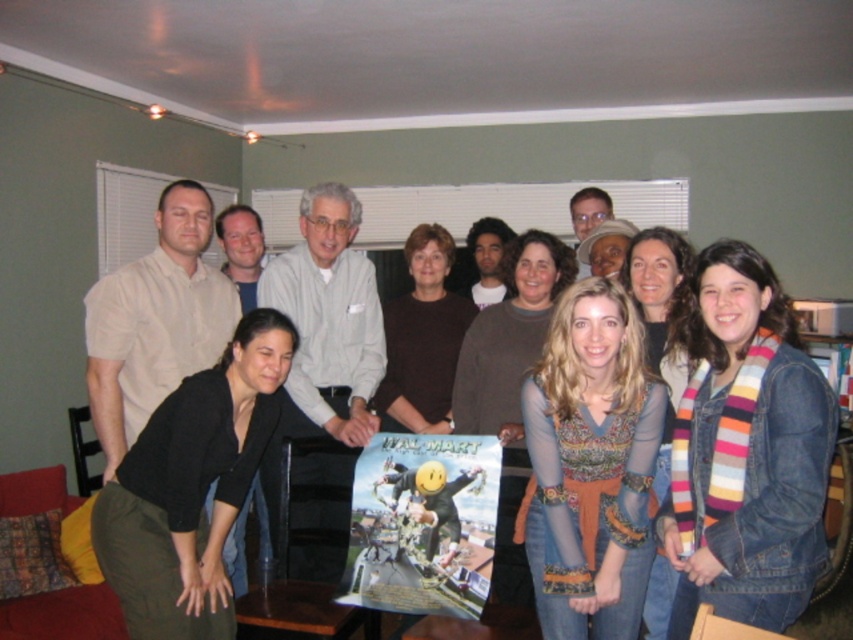
Question: Which of these objects is positioned closest to the black matte pants at lower left?

Choices:
 (A) brown matte sweater at center
 (B) striped scarf at lower right
 (C) printed fabric sweater at center
 (D) striped scarf at center

Answer: (C)

Question: Which of the following is the closest to the observer?

Choices:
 (A) (184, 394)
 (B) (558, 288)

Answer: (A)

Question: Is printed fabric sweater at center wider than striped scarf at center?

Choices:
 (A) yes
 (B) no

Answer: (A)

Question: From the image, what is the correct spatial relationship of multicolored sheer blouse at center in relation to black matte pants at lower left?

Choices:
 (A) left
 (B) right

Answer: (B)

Question: Which object is closer to the camera taking this photo?

Choices:
 (A) printed fabric sweater at center
 (B) multicolored sheer blouse at center

Answer: (B)

Question: Can you confirm if brown matte sweater at center is smaller than striped scarf at center?

Choices:
 (A) yes
 (B) no

Answer: (A)